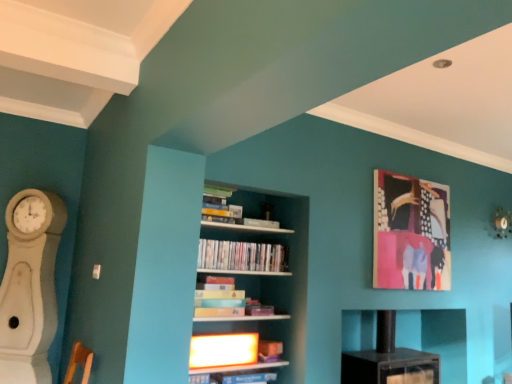
The image size is (512, 384). Find the location of `empty space that is ontop of matte plastic dvds at center, the second book from the top (from a real-world perspective)`. empty space that is ontop of matte plastic dvds at center, the second book from the top (from a real-world perspective) is located at coordinates (247, 243).